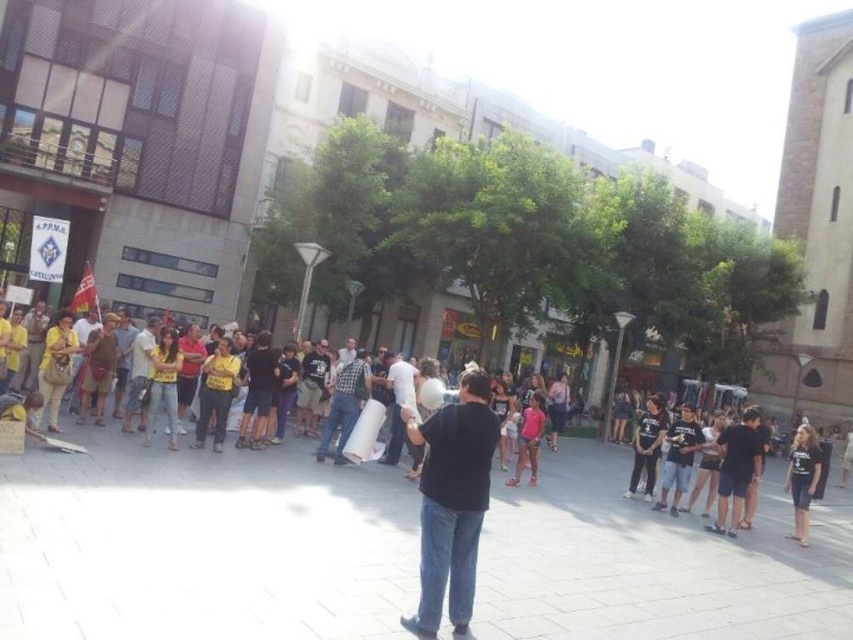
Who is positioned more to the left, gray concrete pavement at center or black matte shirt at center?

black matte shirt at center is more to the left.

Is gray concrete pavement at center below black matte shirt at center?

Indeed, gray concrete pavement at center is positioned under black matte shirt at center.

Where is `gray concrete pavement at center`? The height and width of the screenshot is (640, 853). gray concrete pavement at center is located at coordinates (202, 545).

The height and width of the screenshot is (640, 853). What are the coordinates of `gray concrete pavement at center` in the screenshot? It's located at (202, 545).

Is yellow/yellowish fabric at left to the left of black matte shirt at center from the viewer's perspective?

Incorrect, yellow/yellowish fabric at left is not on the left side of black matte shirt at center.

Does point (328, 524) come farther from viewer compared to point (474, 516)?

That is True.

You are a GUI agent. You are given a task and a screenshot of the screen. Output one action in this format:
    pyautogui.click(x=<x>, y=<y>)
    Task: Click on the yellow/yellowish fabric at left
    
    Given the screenshot: What is the action you would take?
    pyautogui.click(x=196, y=502)

Can you confirm if gray concrete pavement at center is shorter than checkered fabric shirt at center?

No, gray concrete pavement at center is not shorter than checkered fabric shirt at center.

Can you confirm if gray concrete pavement at center is thinner than checkered fabric shirt at center?

In fact, gray concrete pavement at center might be wider than checkered fabric shirt at center.

Is point (100, 458) more distant than point (364, 356)?

No, (100, 458) is closer to viewer.

The height and width of the screenshot is (640, 853). In order to click on gray concrete pavement at center in this screenshot , I will do `click(202, 545)`.